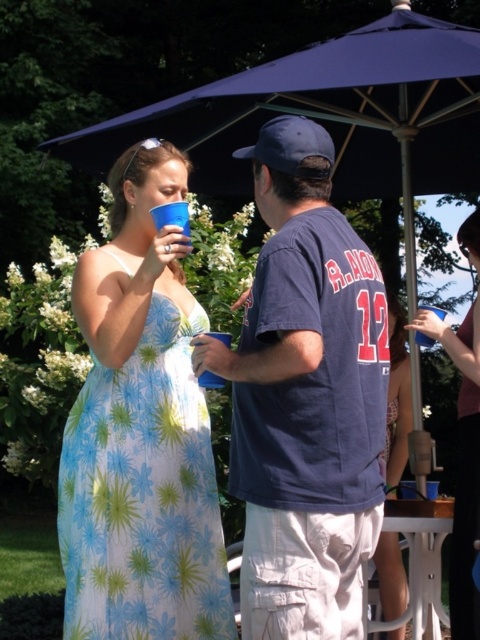
Describe the element at coordinates (466, 515) in the screenshot. Image resolution: width=480 pixels, height=640 pixels. I see `blue floral dress at center` at that location.

Who is more distant from viewer, (467, 492) or (420, 336)?

Positioned behind is point (420, 336).

This screenshot has height=640, width=480. Describe the element at coordinates (466, 515) in the screenshot. I see `blue floral dress at center` at that location.

The height and width of the screenshot is (640, 480). I want to click on blue floral dress at center, so click(x=466, y=515).

Is navy blue t-shirt at center to the left of navy blue fabric baseball cap at center from the viewer's perspective?

Incorrect, navy blue t-shirt at center is not on the left side of navy blue fabric baseball cap at center.

What do you see at coordinates (304, 397) in the screenshot?
I see `navy blue t-shirt at center` at bounding box center [304, 397].

Which is in front, point (272, 236) or point (257, 154)?

Point (257, 154) is more forward.

You are a GUI agent. You are given a task and a screenshot of the screen. Output one action in this format:
    pyautogui.click(x=<x>, y=<y>)
    Task: Click on the navy blue t-shirt at center
    This screenshot has width=480, height=640.
    Given the screenshot: What is the action you would take?
    click(304, 397)

Is blue fabric umbrella at upper center further to the viewer compared to blue plastic cup at upper left?

Yes.

Is point (347, 188) positioned after point (170, 204)?

Yes.

Where is `blue fabric umbrella at upper center`? blue fabric umbrella at upper center is located at coordinates (331, 115).

Find the location of a particular element. Image resolution: width=480 pixels, height=640 pixels. blue fabric umbrella at upper center is located at coordinates point(331,115).